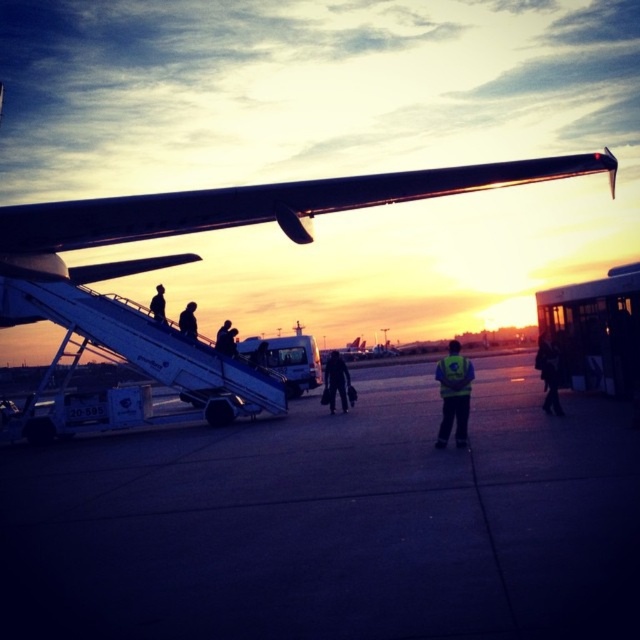
Question: Is dark blue fabric jacket at lower right above silhouette figure at upper left?

Choices:
 (A) yes
 (B) no

Answer: (B)

Question: Where is metallic silver wing at upper center located in relation to silhouette figure at upper left in the image?

Choices:
 (A) left
 (B) right

Answer: (B)

Question: Which of these objects is positioned farthest from the reflective yellow vest at center?

Choices:
 (A) dark blue fabric jacket at lower right
 (B) silhouette figure at upper left
 (C) metallic silver wing at upper center
 (D) silhouette figure at center

Answer: (D)

Question: Which point is farther to the camera?

Choices:
 (A) (54, 212)
 (B) (193, 310)

Answer: (B)

Question: In this image, where is reflective yellow vest at center located relative to dark blue jeans at center?

Choices:
 (A) left
 (B) right

Answer: (B)

Question: Based on their relative distances, which object is farther from the dark blue fabric jacket at lower right?

Choices:
 (A) silhouette figure at center
 (B) reflective yellow vest at center
 (C) dark blue jeans at center

Answer: (A)